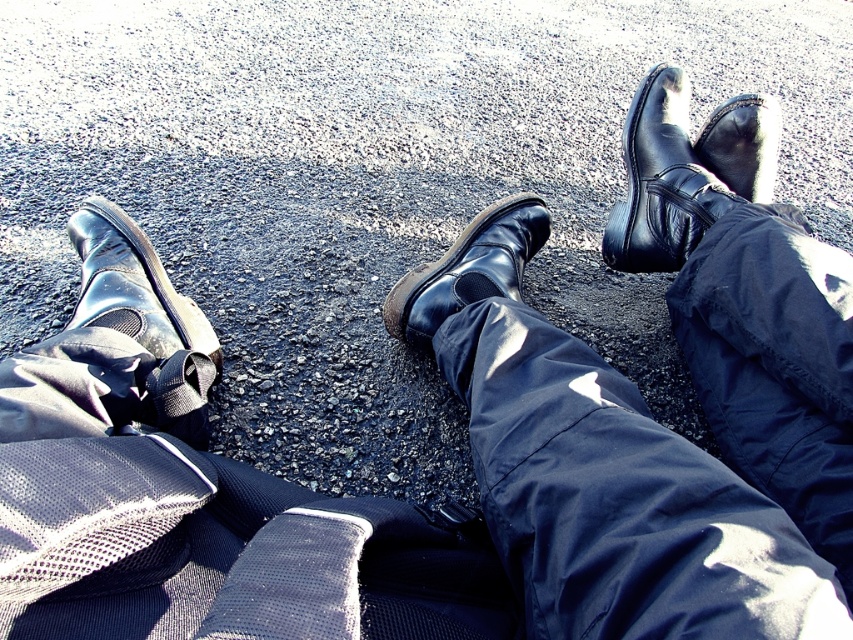
Does glossy leather boot at lower left appear on the left side of shiny black boot at center?

Correct, you'll find glossy leather boot at lower left to the left of shiny black boot at center.

Can you confirm if glossy leather boot at lower left is smaller than shiny black boot at center?

Yes, glossy leather boot at lower left is smaller than shiny black boot at center.

Locate an element on the screen. The image size is (853, 640). glossy leather boot at lower left is located at coordinates (132, 285).

Does shiny black boot at upper right have a larger size compared to shiny black boot at upper center?

Yes, shiny black boot at upper right is bigger than shiny black boot at upper center.

Locate an element on the screen. The height and width of the screenshot is (640, 853). shiny black boot at upper right is located at coordinates (685, 170).

At what (x,y) coordinates should I click in order to perform the action: click on shiny black boot at upper right. Please return your answer as a coordinate pair (x, y). This screenshot has height=640, width=853. Looking at the image, I should click on (685, 170).

Is shiny black boot at center wider than shiny black boot at upper center?

Yes, shiny black boot at center is wider than shiny black boot at upper center.

Who is higher up, shiny black boot at center or shiny black boot at upper center?

shiny black boot at upper center is above.

Describe the element at coordinates (468, 268) in the screenshot. The image size is (853, 640). I see `shiny black boot at center` at that location.

You are a GUI agent. You are given a task and a screenshot of the screen. Output one action in this format:
    pyautogui.click(x=<x>, y=<y>)
    Task: Click on the shiny black boot at center
    
    Given the screenshot: What is the action you would take?
    pyautogui.click(x=468, y=268)